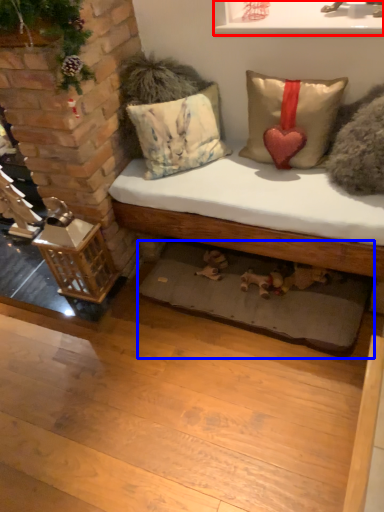
Question: Which of the following is the closest to the observer, window sill (highlighted by a red box) or mat (highlighted by a blue box)?

Choices:
 (A) window sill
 (B) mat

Answer: (A)